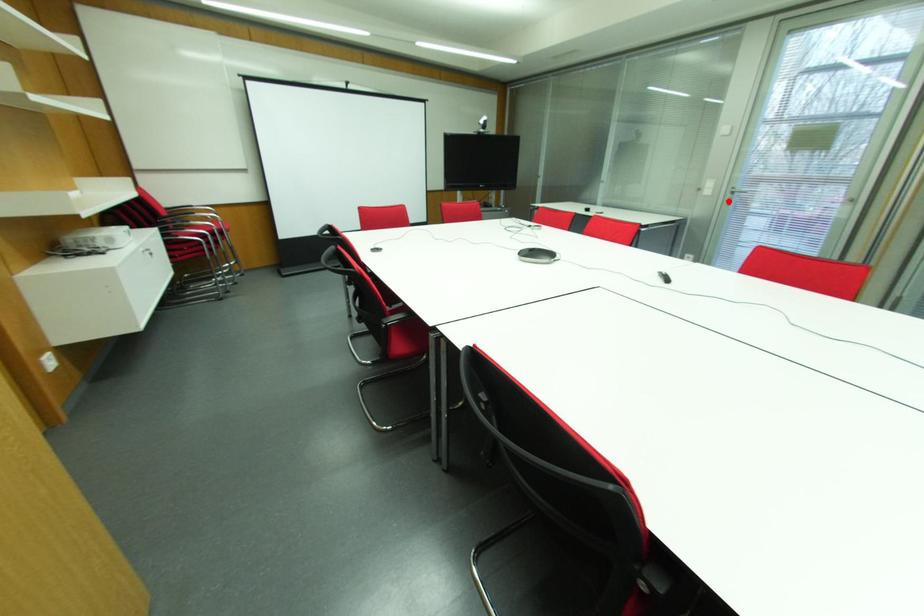
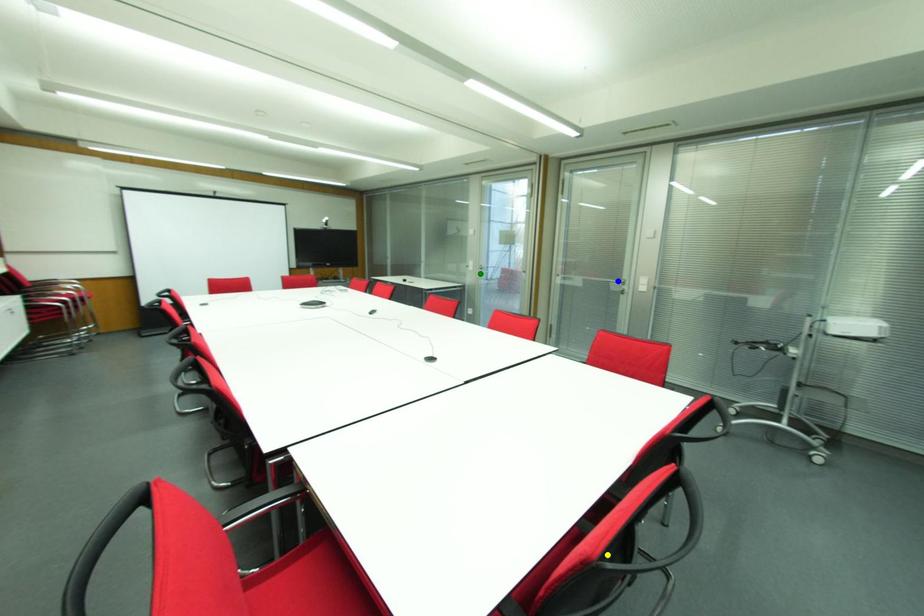
Question: I am providing you with two images of the same scene from different viewpoints. A red point is marked on the first image. You are given multiple points on the second image. Which point in image 2 represents the same 3d spot as the red point in image 1?

Choices:
 (A) yellow point
 (B) blue point
 (C) green point

Answer: (C)